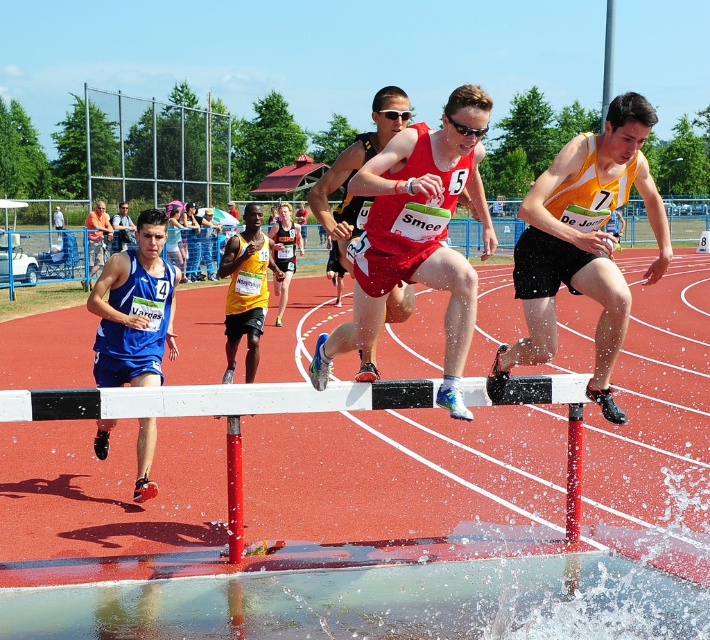
Can you confirm if white plastic hurdle at center is positioned to the right of blue fabric shorts at left?

Correct, you'll find white plastic hurdle at center to the right of blue fabric shorts at left.

What do you see at coordinates (214, 412) in the screenshot?
I see `white plastic hurdle at center` at bounding box center [214, 412].

Identify the location of white plastic hurdle at center. (214, 412).

Measure the distance between blue fabric shorts at left and matte red bib at center.

A distance of 7.18 feet exists between blue fabric shorts at left and matte red bib at center.

From the picture: Between blue fabric shorts at left and matte red bib at center, which one is positioned lower?

Positioned lower is blue fabric shorts at left.

Between point (143, 236) and point (361, 195), which one is positioned in front?

Positioned in front is point (361, 195).

You are a GUI agent. You are given a task and a screenshot of the screen. Output one action in this format:
    pyautogui.click(x=<x>, y=<y>)
    Task: Click on the blue fabric shorts at left
    
    Given the screenshot: What is the action you would take?
    pyautogui.click(x=133, y=308)

Is yellow mesh tank top at center above blue fabric shirt at center?

No.

Is point (258, 248) positioned behind point (124, 221)?

That is False.

The width and height of the screenshot is (710, 640). Identify the location of yellow mesh tank top at center. (246, 289).